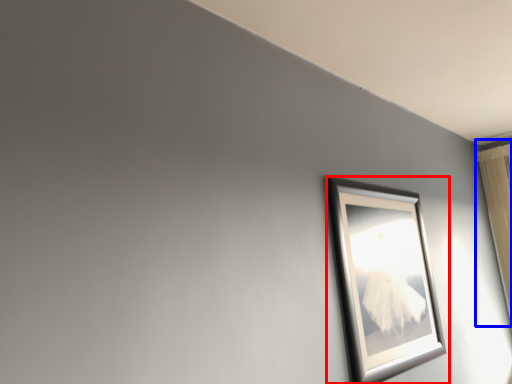
Question: Among these objects, which one is nearest to the camera, picture frame (highlighted by a red box) or curtain (highlighted by a blue box)?

Choices:
 (A) picture frame
 (B) curtain

Answer: (A)